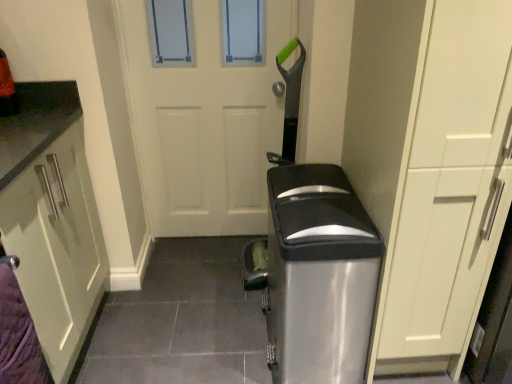
Question: Can you confirm if white matte door at center is positioned to the right of satin silver trash can at center?

Choices:
 (A) no
 (B) yes

Answer: (A)

Question: From a real-world perspective, does white matte door at center sit lower than satin silver trash can at center?

Choices:
 (A) no
 (B) yes

Answer: (A)

Question: Is white matte door at center oriented towards satin silver trash can at center?

Choices:
 (A) no
 (B) yes

Answer: (B)

Question: From the image's perspective, is white matte door at center above satin silver trash can at center?

Choices:
 (A) no
 (B) yes

Answer: (B)

Question: From a real-world perspective, is white matte door at center over satin silver trash can at center?

Choices:
 (A) yes
 (B) no

Answer: (A)

Question: Are white matte door at center and satin silver trash can at center beside each other?

Choices:
 (A) no
 (B) yes

Answer: (A)

Question: Is satin silver trash can at center placed right next to matte white cabinet at right?

Choices:
 (A) no
 (B) yes

Answer: (A)

Question: Can you confirm if satin silver trash can at center is thinner than matte white cabinet at right?

Choices:
 (A) yes
 (B) no

Answer: (A)

Question: Can matte white cabinet at right be found inside satin silver trash can at center?

Choices:
 (A) no
 (B) yes

Answer: (A)

Question: Considering the relative sizes of satin silver trash can at center and matte white cabinet at right in the image provided, is satin silver trash can at center shorter than matte white cabinet at right?

Choices:
 (A) no
 (B) yes

Answer: (B)

Question: Does satin silver trash can at center have a greater height compared to matte white cabinet at right?

Choices:
 (A) no
 (B) yes

Answer: (A)

Question: Is satin silver trash can at center wider than matte white cabinet at right?

Choices:
 (A) no
 (B) yes

Answer: (A)

Question: Could you tell me if matte white cabinet at right is facing white matte door at center?

Choices:
 (A) yes
 (B) no

Answer: (B)